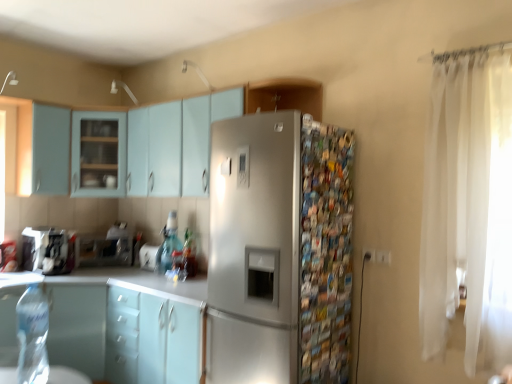
Describe the element at coordinates (188, 256) in the screenshot. I see `translucent glass bottle at center, which ranks as the second bottle in back-to-front order` at that location.

From the picture: What is the approximate height of light blue matte cabinet at upper left, which ranks as the 4th cabinetry in bottom-to-top order?

light blue matte cabinet at upper left, which ranks as the 4th cabinetry in bottom-to-top order, is 75.47 centimeters tall.

Find the location of `translucent glass bottle at center, the 3th bottle in the left-to-right sequence`. translucent glass bottle at center, the 3th bottle in the left-to-right sequence is located at coordinates (188, 256).

Is light blue matte cabinet at upper left, which appears as the fourth cabinetry when viewed from the top, positioned beyond the bounds of teal glass bottle at center?

Yes.

Could you tell me if light blue matte cabinet at upper left, which ranks as the 4th cabinetry in bottom-to-top order, is turned towards teal glass bottle at center?

No.

How far apart are light blue matte cabinet at upper left, which ranks as the 4th cabinetry in bottom-to-top order, and teal glass bottle at center?

The distance of light blue matte cabinet at upper left, which ranks as the 4th cabinetry in bottom-to-top order, from teal glass bottle at center is 34.49 inches.

Is light blue matte cabinet at upper left, which ranks as the 4th cabinetry in bottom-to-top order, next to teal glass bottle at center?

light blue matte cabinet at upper left, which ranks as the 4th cabinetry in bottom-to-top order, and teal glass bottle at center are not in contact.

Is there a large distance between clear plastic bottle at lower left, which is the first bottle from front to back, and satin silver refrigerator at center?

clear plastic bottle at lower left, which is the first bottle from front to back, is far away from satin silver refrigerator at center.

Looking at their sizes, would you say clear plastic bottle at lower left, which is the first bottle from front to back, is wider or thinner than satin silver refrigerator at center?

Considering their sizes, clear plastic bottle at lower left, which is the first bottle from front to back, looks slimmer than satin silver refrigerator at center.

Considering the sizes of objects clear plastic bottle at lower left, the 3th bottle when ordered from back to front, and white sheer curtain at right in the image provided, who is thinner, clear plastic bottle at lower left, the 3th bottle when ordered from back to front, or white sheer curtain at right?

clear plastic bottle at lower left, the 3th bottle when ordered from back to front.

Can you confirm if clear plastic bottle at lower left, which is the second bottle in right-to-left order, is smaller than white sheer curtain at right?

Indeed, clear plastic bottle at lower left, which is the second bottle in right-to-left order, has a smaller size compared to white sheer curtain at right.

Does point (23, 361) lie in front of point (485, 113)?

No, (23, 361) is further to viewer.

Based on their sizes in the image, would you say white sheer curtain at right is bigger or smaller than clear glass jar at center, the third appliance in the left-to-right sequence?

In the image, white sheer curtain at right appears to be larger than clear glass jar at center, the third appliance in the left-to-right sequence.

Does white sheer curtain at right have a greater height compared to clear glass jar at center, the first appliance in the right-to-left sequence?

Yes, white sheer curtain at right is taller than clear glass jar at center, the first appliance in the right-to-left sequence.

Can you confirm if white sheer curtain at right is positioned to the left of clear glass jar at center, the third appliance in the left-to-right sequence?

Incorrect, white sheer curtain at right is not on the left side of clear glass jar at center, the third appliance in the left-to-right sequence.

Identify the location of curtain on the right of clear glass jar at center, the first appliance in the right-to-left sequence. (468, 207).

From a real-world perspective, between light blue matte cabinet at upper left, acting as the fifth cabinetry starting from the bottom, and clear plastic bottle at lower left, which is the first bottle from front to back, who is vertically lower?

From a 3D spatial view, clear plastic bottle at lower left, which is the first bottle from front to back, is below.

Which is correct: light blue matte cabinet at upper left, acting as the fifth cabinetry starting from the bottom, is inside clear plastic bottle at lower left, which is the first bottle from front to back, or outside of it?

light blue matte cabinet at upper left, acting as the fifth cabinetry starting from the bottom, lies outside clear plastic bottle at lower left, which is the first bottle from front to back.

Is light blue matte cabinet at upper left, acting as the fifth cabinetry starting from the bottom, aimed at clear plastic bottle at lower left, the 3th bottle when ordered from back to front?

No, light blue matte cabinet at upper left, acting as the fifth cabinetry starting from the bottom, is not turned towards clear plastic bottle at lower left, the 3th bottle when ordered from back to front.

Considering the relative sizes of light blue matte cabinet at upper left, acting as the fifth cabinetry starting from the bottom, and clear plastic bottle at lower left, the 2th bottle in the left-to-right sequence, in the image provided, is light blue matte cabinet at upper left, acting as the fifth cabinetry starting from the bottom, smaller than clear plastic bottle at lower left, the 2th bottle in the left-to-right sequence,?

No.

From the image's perspective, is translucent glass bottle at center, which ranks as the second bottle in back-to-front order, positioned above or below brushed metal coffee maker at left, which is the 1th appliance in left-to-right order?

translucent glass bottle at center, which ranks as the second bottle in back-to-front order, is below brushed metal coffee maker at left, which is the 1th appliance in left-to-right order.

From a real-world perspective, who is located lower, translucent glass bottle at center, the second bottle positioned from the front, or brushed metal coffee maker at left, placed as the third appliance when sorted from right to left?

In real-world perspective, translucent glass bottle at center, the second bottle positioned from the front, is lower.

Between translucent glass bottle at center, the second bottle positioned from the front, and brushed metal coffee maker at left, placed as the third appliance when sorted from right to left, which one has larger size?

Bigger between the two is brushed metal coffee maker at left, placed as the third appliance when sorted from right to left.

Considering the sizes of objects translucent glass bottle at center, which ranks as the second bottle in back-to-front order, and brushed metal coffee maker at left, placed as the third appliance when sorted from right to left, in the image provided, who is wider, translucent glass bottle at center, which ranks as the second bottle in back-to-front order, or brushed metal coffee maker at left, placed as the third appliance when sorted from right to left,?

Wider between the two is brushed metal coffee maker at left, placed as the third appliance when sorted from right to left.

Considering the sizes of objects light blue matte cabinet at upper left, which ranks as the 4th cabinetry in bottom-to-top order, and light blue matte cabinet at upper left, arranged as the 2th cabinetry when viewed from the top, in the image provided, who is wider, light blue matte cabinet at upper left, which ranks as the 4th cabinetry in bottom-to-top order, or light blue matte cabinet at upper left, arranged as the 2th cabinetry when viewed from the top,?

light blue matte cabinet at upper left, which ranks as the 4th cabinetry in bottom-to-top order, is wider.

I want to click on the 1st cabinetry directly above the light blue matte cabinet at upper left, which appears as the fourth cabinetry when viewed from the top (from a real-world perspective), so click(42, 150).

From the image's perspective, which is below, light blue matte cabinet at upper left, which appears as the fourth cabinetry when viewed from the top, or light blue matte cabinet at upper left, arranged as the 2th cabinetry when viewed from the top?

light blue matte cabinet at upper left, which appears as the fourth cabinetry when viewed from the top, appears lower in the image.

From the picture: Is light blue matte cabinet at upper left, which appears as the fourth cabinetry when viewed from the top, spatially inside light blue matte cabinet at upper left, which appears as the sixth cabinetry when ordered from the bottom, or outside of it?

light blue matte cabinet at upper left, which appears as the fourth cabinetry when viewed from the top, is spatially situated outside light blue matte cabinet at upper left, which appears as the sixth cabinetry when ordered from the bottom.

Locate an element on the screen. teal below the light blue matte cabinet at upper left, which appears as the fourth cabinetry when viewed from the top (from the image's perspective) is located at coordinates (167, 250).

From a real-world perspective, starting from the satin silver refrigerator at center, which bottle is the 2nd one below it? Please provide its 2D coordinates.

[(32, 336)]

Which object lies nearer to the anchor point clear plastic bottle at lower left, which is the first bottle from front to back, teal glass bottle at center or satin silver microwave at center, the second appliance when ordered from left to right?

Among the two, satin silver microwave at center, the second appliance when ordered from left to right, is located nearer to clear plastic bottle at lower left, which is the first bottle from front to back.

Considering their positions, is satin finish cabinet at upper center, the seventh cabinetry in the bottom-to-top sequence, positioned closer to light blue matte cabinet at upper left, which ranks as the 4th cabinetry in bottom-to-top order, than light blue matte cabinet at center, which ranks as the 7th cabinetry in top-to-bottom order?

satin finish cabinet at upper center, the seventh cabinetry in the bottom-to-top sequence, lies closer to light blue matte cabinet at upper left, which ranks as the 4th cabinetry in bottom-to-top order, than the other object.

From the image, which object appears to be farther from brushed metal coffee maker at left, which is the 1th appliance in left-to-right order, satin silver microwave at center, the second appliance when ordered from left to right, or clear glass jar at center, the third appliance in the left-to-right sequence?

Based on the image, clear glass jar at center, the third appliance in the left-to-right sequence, appears to be further to brushed metal coffee maker at left, which is the 1th appliance in left-to-right order.

When comparing their distances from translucent glass bottle at center, the second bottle positioned from the front, does satin silver microwave at center, which ranks as the second appliance in right-to-left order, or white sheer curtain at right seem further?

The object further to translucent glass bottle at center, the second bottle positioned from the front, is white sheer curtain at right.

Estimate the real-world distances between objects in this image. Which object is closer to satin silver microwave at center, which ranks as the second appliance in right-to-left order, satin finish cabinet at upper center, the seventh cabinetry in the bottom-to-top sequence, or teal glass bottle at center?

teal glass bottle at center is closer to satin silver microwave at center, which ranks as the second appliance in right-to-left order.

Based on their spatial positions, is white sheer curtain at right or teal glass bottle at center closer to light blue matte cabinet at upper center, the 5th cabinetry viewed from the top?

The object closer to light blue matte cabinet at upper center, the 5th cabinetry viewed from the top, is teal glass bottle at center.

Estimate the real-world distances between objects in this image. Which object is further from light blue matte cabinet at upper left, the third cabinetry in the top-to-bottom sequence, teal glass bottle at center or light blue matte cabinet at center, which ranks as the 7th cabinetry in top-to-bottom order?

light blue matte cabinet at center, which ranks as the 7th cabinetry in top-to-bottom order, is further to light blue matte cabinet at upper left, the third cabinetry in the top-to-bottom sequence.

Looking at the image, which one is located closer to white sheer curtain at right, clear plastic bottle at lower left, the 2th bottle in the left-to-right sequence, or brushed metal coffee maker at left, which is the 1th appliance in left-to-right order?

clear plastic bottle at lower left, the 2th bottle in the left-to-right sequence, is closer to white sheer curtain at right.

The width and height of the screenshot is (512, 384). I want to click on teal between translucent glass bottle at center, which is the third bottle from right to left, and translucent glass bottle at center, the 3th bottle in the left-to-right sequence, in the horizontal direction, so click(167, 250).

The image size is (512, 384). What are the coordinates of `bottle positioned between light blue matte cabinet at center, the 1th cabinetry in the bottom-to-top sequence, and teal glass bottle at center from near to far` in the screenshot? It's located at (188, 256).

The height and width of the screenshot is (384, 512). In order to click on curtain between clear plastic bottle at lower left, the 3th bottle when ordered from back to front, and teal glass bottle at center in the front-back direction in this screenshot , I will do (468, 207).

The height and width of the screenshot is (384, 512). In order to click on teal between satin silver microwave at center, which ranks as the second appliance in right-to-left order, and white sheer curtain at right from left to right in this screenshot , I will do [167, 250].